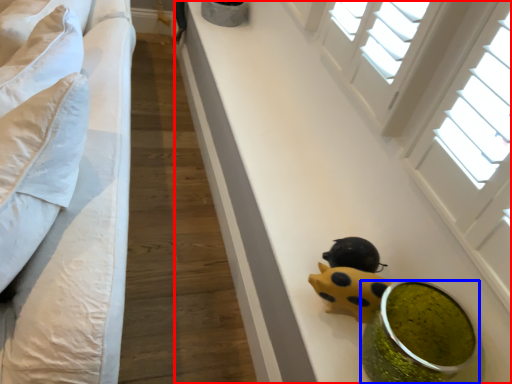
Question: Which object appears closest to the camera in this image, table (highlighted by a red box) or food (highlighted by a blue box)?

Choices:
 (A) table
 (B) food

Answer: (B)